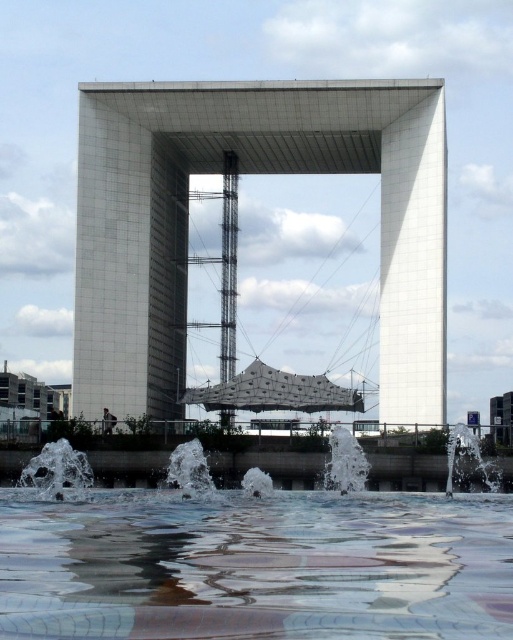
Does white concrete structure at center lie in front of clear water at lower right?

No.

The width and height of the screenshot is (513, 640). Describe the element at coordinates (248, 172) in the screenshot. I see `white concrete structure at center` at that location.

You are a GUI agent. You are given a task and a screenshot of the screen. Output one action in this format:
    pyautogui.click(x=<x>, y=<y>)
    Task: Click on the white concrete structure at center
    Image resolution: width=513 pixels, height=640 pixels.
    Given the screenshot: What is the action you would take?
    pyautogui.click(x=248, y=172)

Between clear glass water at center and white smooth pillar at right, which one has less height?

clear glass water at center is shorter.

Does clear glass water at center have a lesser width compared to white smooth pillar at right?

In fact, clear glass water at center might be wider than white smooth pillar at right.

Does point (224, 628) come closer to viewer compared to point (402, 412)?

Yes, it is in front of point (402, 412).

You are a GUI agent. You are given a task and a screenshot of the screen. Output one action in this format:
    pyautogui.click(x=<x>, y=<y>)
    Task: Click on the clear glass water at center
    The width and height of the screenshot is (513, 640).
    Given the screenshot: What is the action you would take?
    pyautogui.click(x=255, y=564)

Does white smooth pillar at right have a larger size compared to clear water at lower left?

Indeed, white smooth pillar at right has a larger size compared to clear water at lower left.

Is point (389, 340) closer to camera compared to point (56, 461)?

No.

Which is in front, point (431, 275) or point (68, 483)?

Point (68, 483) is more forward.

You are a GUI agent. You are given a task and a screenshot of the screen. Output one action in this format:
    pyautogui.click(x=<x>, y=<y>)
    Task: Click on the white smooth pillar at right
    This screenshot has height=640, width=513.
    Given the screenshot: What is the action you would take?
    pyautogui.click(x=413, y=266)